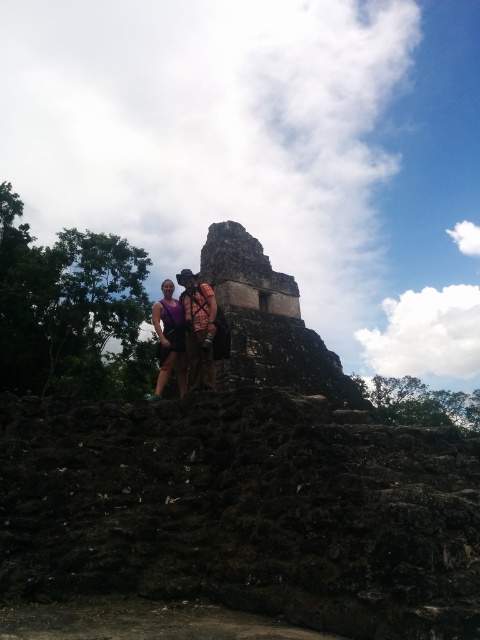
You are standing at the base of the pyramid in the ancient Mayan ruin and see two points marked on the steps leading up to the pyramid. The points are labeled as point 1 at coordinates point (223, 253) and point 2 at coordinates point (165, 288). Which point is closer to you?

Point 1 at coordinates point (223, 253) is closer to you because it is further to the camera than point 2 at coordinates point (165, 288).

You are a tour guide at the ancient Mayan ruin and need to locate the tourist wearing the matte purple shirt at center. According to the coordinates provided, where exactly should you look to find them?

The matte purple shirt at center is located at point [184,333], so you should look at that coordinate to find the tourist.

You are a photographer standing at the base of the pyramid. You want to take a photo that includes both the point at coordinates point (x=245, y=273) and point (x=186, y=385). Which point should you focus on to ensure both are in sharp focus?

You should focus on the point closer to the camera, which is point (x=186, y=385), to ensure both points are in sharp focus.